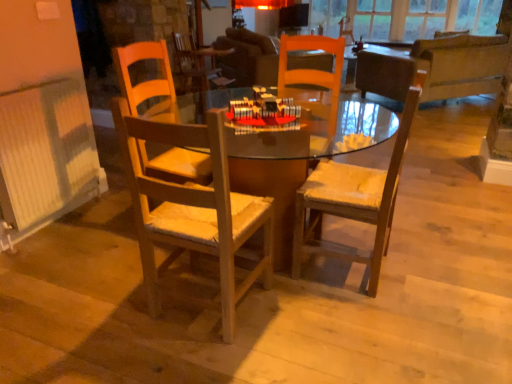
You are a GUI agent. You are given a task and a screenshot of the screen. Output one action in this format:
    pyautogui.click(x=<x>, y=<y>)
    Task: Click on the unoccupied region to the right of wooden chair with cushion at center, which is counted as the second chair, starting from the left
    
    Given the screenshot: What is the action you would take?
    pyautogui.click(x=425, y=260)